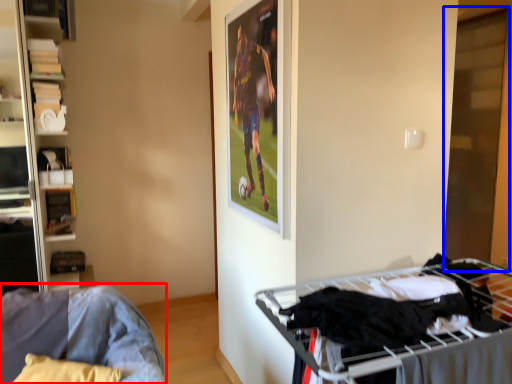
Question: Which object appears closest to the camera in this image, furniture (highlighted by a red box) or glass door (highlighted by a blue box)?

Choices:
 (A) furniture
 (B) glass door

Answer: (A)